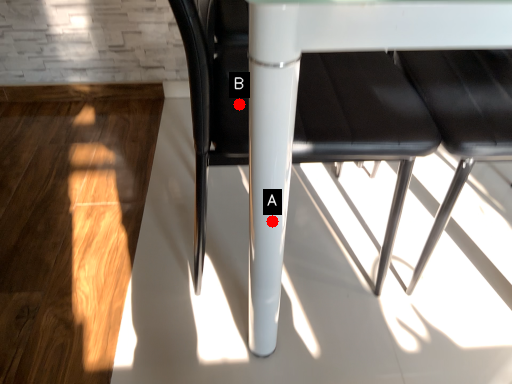
Question: Two points are circled on the image, labeled by A and B beside each circle. Which point is closer to the camera?

Choices:
 (A) A is closer
 (B) B is closer

Answer: (A)